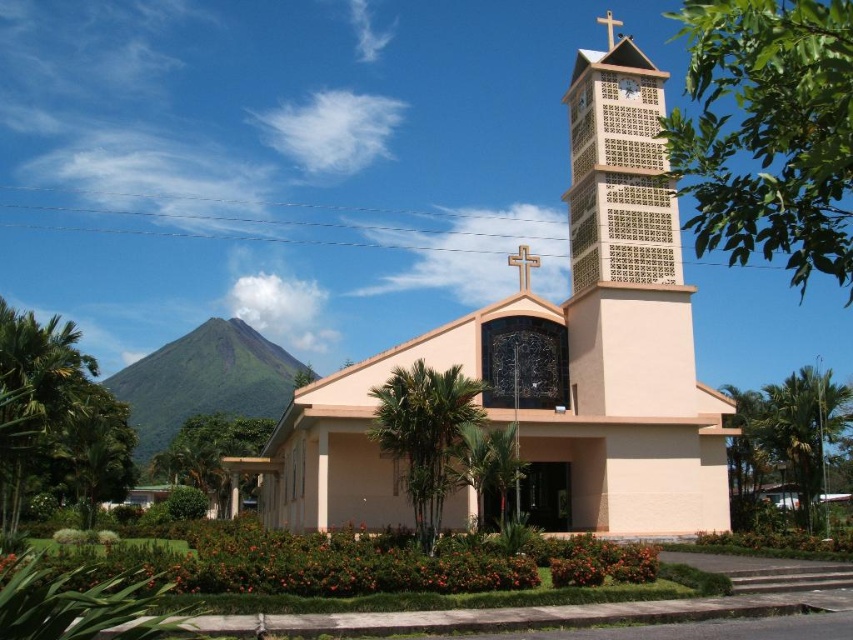
You are an architect designing a new church. You want to place a large cross on the roof of the beige concrete church at center so it can be seen from afar. Considering the size of the matte beige clock at upper center, will the cross fit on the roof without being too small compared to the clock?

The beige concrete church at center is bigger than the matte beige clock at upper center, so the cross should fit well on the roof without being too small compared to the clock.

You are a drone operator who needs to fly a drone between the beige concrete church at center and the beige lattice clock tower at center. The drone has a maximum flight distance of 10 meters. Can the drone safely fly between them without exceeding its range?

The distance between the beige concrete church at center and the beige lattice clock tower at center is 8.95 meters, which is within the drone operator maximum flight range of 10 meters. The drone can safely fly between them.